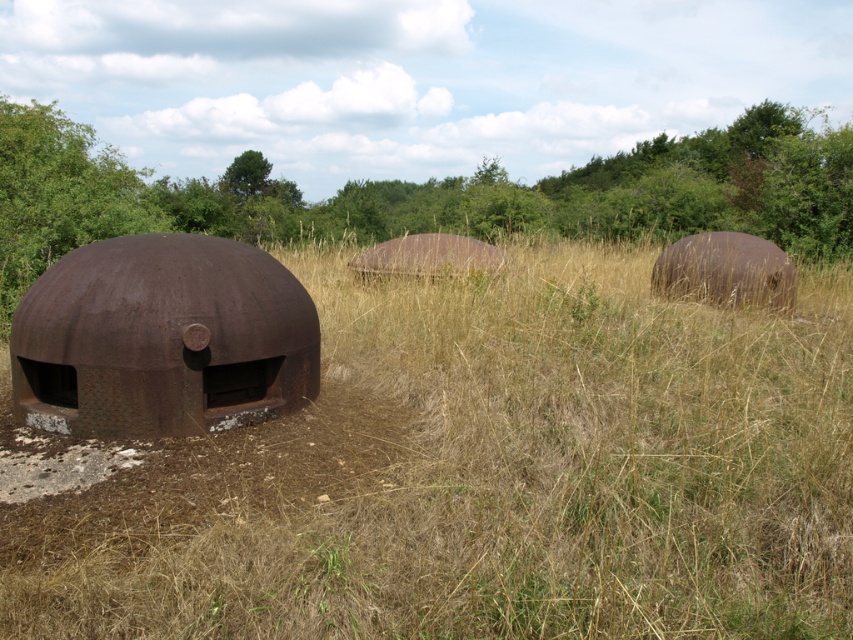
Question: Which is nearer to the green leafy tree at upper center?

Choices:
 (A) brown dry grass at center
 (B) rusty metal bunker at left

Answer: (B)

Question: Does brown dry grass at center appear under rusty metal bunker at left?

Choices:
 (A) no
 (B) yes

Answer: (A)

Question: Is green leafy tree at upper center wider than rusty metal bunker at left?

Choices:
 (A) no
 (B) yes

Answer: (B)

Question: Is green leafy tree at upper center thinner than rusty metal bunker at left?

Choices:
 (A) yes
 (B) no

Answer: (B)

Question: Which point is closer to the camera?

Choices:
 (A) green leafy tree at upper center
 (B) brown dry grass at center

Answer: (B)

Question: Which point appears closest to the camera in this image?

Choices:
 (A) (532, 195)
 (B) (140, 376)

Answer: (B)